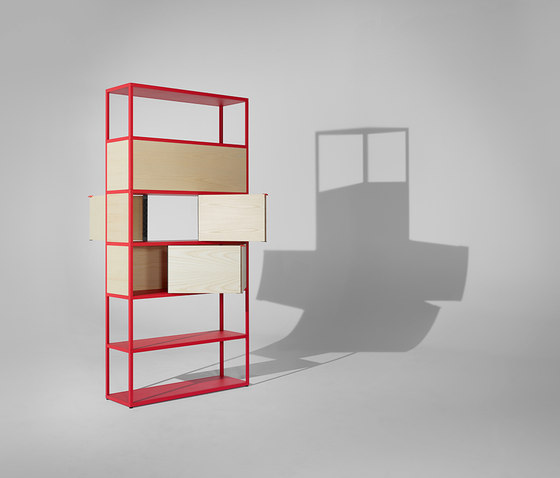
Where is `shadow of sides of shelves`? shadow of sides of shelves is located at coordinates pyautogui.click(x=213, y=364), pyautogui.click(x=177, y=387), pyautogui.click(x=289, y=374), pyautogui.click(x=333, y=360), pyautogui.click(x=319, y=172), pyautogui.click(x=365, y=152), pyautogui.click(x=407, y=164).